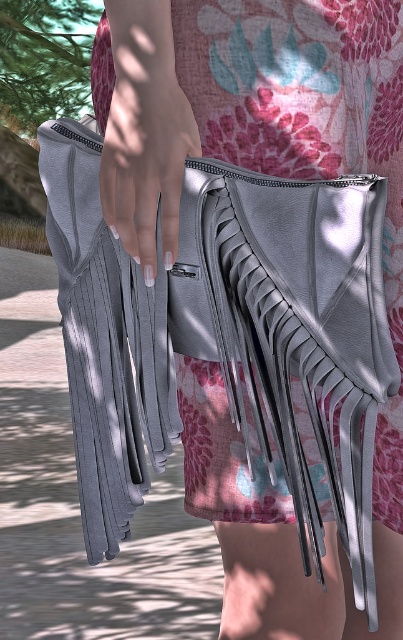
Question: Among these objects, which one is farthest from the camera?

Choices:
 (A) matte gray leather dress at center
 (B) white matte nail at center

Answer: (A)

Question: Which point is closer to the camera taking this photo?

Choices:
 (A) (195, 138)
 (B) (141, 176)

Answer: (B)

Question: Is matte gray leather dress at center above white matte nail at center?

Choices:
 (A) yes
 (B) no

Answer: (B)

Question: Is matte gray leather dress at center bigger than white matte nail at center?

Choices:
 (A) yes
 (B) no

Answer: (A)

Question: Is matte gray leather dress at center closer to camera compared to white matte nail at center?

Choices:
 (A) no
 (B) yes

Answer: (A)

Question: Which point appears closest to the camera in this image?

Choices:
 (A) (265, 129)
 (B) (166, 186)

Answer: (B)